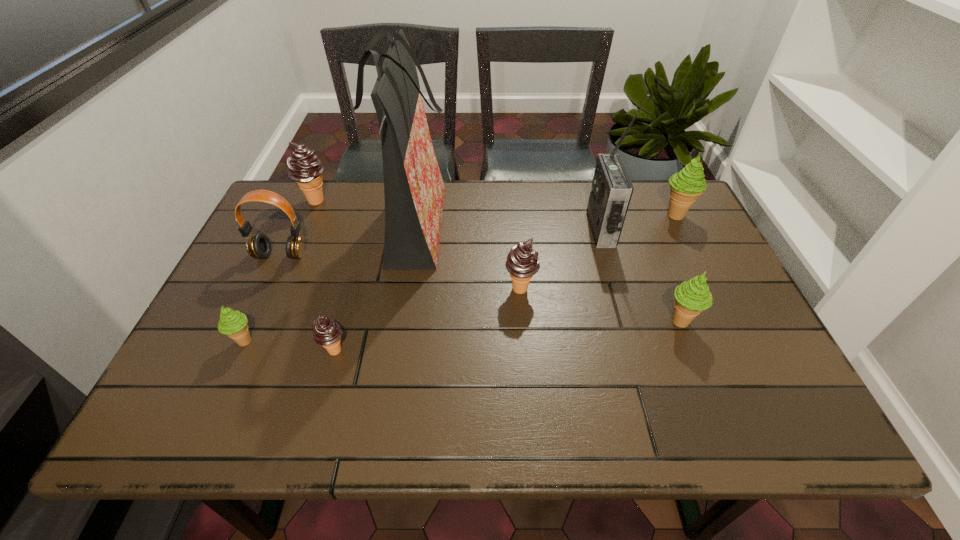
I want to click on black shopping bag, so click(x=413, y=186).

Find the location of a particular element. The width and height of the screenshot is (960, 540). the tallest object is located at coordinates (413, 186).

You are a GUI agent. You are given a task and a screenshot of the screen. Output one action in this format:
    pyautogui.click(x=<x>, y=<y>)
    Task: Click on the radio receiver
    The height and width of the screenshot is (540, 960).
    Given the screenshot: What is the action you would take?
    pyautogui.click(x=611, y=192)

What are the coordinates of `the seventh object from left to right` in the screenshot? It's located at (611, 192).

Locate an element on the screen. This screenshot has height=540, width=960. the farthest chocolate icecream is located at coordinates (304, 166).

Where is `the leftmost chocolate icecream`? This screenshot has height=540, width=960. the leftmost chocolate icecream is located at coordinates (304, 166).

Where is `the rightmost object`? The height and width of the screenshot is (540, 960). the rightmost object is located at coordinates (686, 185).

Locate an element on the screen. Image resolution: width=960 pixels, height=540 pixels. the farthest green icecream is located at coordinates (686, 185).

Find the location of a particular element. headset is located at coordinates (258, 245).

Identify the location of the third icecream from right to left. This screenshot has height=540, width=960. pyautogui.click(x=522, y=263).